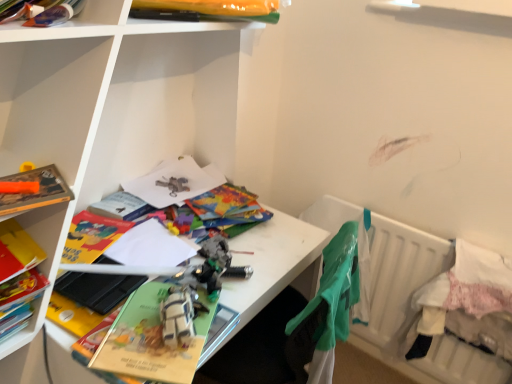
In order to face white plastic table at center, should I rotate leftwards or rightwards?

It's best to rotate right around 0.555 degrees.

What do you see at coordinates (180, 316) in the screenshot? This screenshot has height=384, width=512. I see `white plastic toy at center` at bounding box center [180, 316].

What are the coordinates of `white plastic toy at center` in the screenshot? It's located at (180, 316).

This screenshot has height=384, width=512. What do you see at coordinates (76, 24) in the screenshot? I see `matte plastic books at upper left, which is the 2th shelf in bottom-to-top order` at bounding box center [76, 24].

Describe the element at coordinates (151, 339) in the screenshot. I see `matte green paperback book at center, the first paperback book positioned from the bottom` at that location.

The width and height of the screenshot is (512, 384). Describe the element at coordinates (125, 109) in the screenshot. I see `white matte desk at center, marked as the second shelf in a top-to-bottom arrangement` at that location.

What do you see at coordinates (467, 302) in the screenshot? The width and height of the screenshot is (512, 384). I see `white fabric bed at lower right, which appears as the 1th bed when viewed from the front` at bounding box center [467, 302].

Where is `green fabric at right`? Image resolution: width=512 pixels, height=384 pixels. green fabric at right is located at coordinates (331, 304).

From a real-world perspective, is matte orange book at left, which is the 1th paperback book from left to right, located higher than white matte desk at center, the first shelf viewed from the right?

Correct, in the physical world, matte orange book at left, which is the 1th paperback book from left to right, is higher than white matte desk at center, the first shelf viewed from the right.

Based on the photo, from the image's perspective, who appears lower, matte orange book at left, which is the 1th paperback book from left to right, or white matte desk at center, which is the 2th shelf in left-to-right order?

white matte desk at center, which is the 2th shelf in left-to-right order, from the image's perspective.

Is matte orange book at left, which is the 1th paperback book from left to right, thinner than white matte desk at center, acting as the first shelf starting from the front?

Indeed, matte orange book at left, which is the 1th paperback book from left to right, has a lesser width compared to white matte desk at center, acting as the first shelf starting from the front.

You are a GUI agent. You are given a task and a screenshot of the screen. Output one action in this format:
    pyautogui.click(x=<x>, y=<y>)
    Task: Click on the 1st bed below the white matte desk at center, acting as the first shelf starting from the front (from the image's perspective)
    
    Given the screenshot: What is the action you would take?
    pyautogui.click(x=407, y=304)

Would you say white plastic bed at lower right, which is the 1th bed in back-to-front order, is part of white matte desk at center, which is the second shelf in back-to-front order,'s contents?

No.

How many degrees apart are the facing directions of white matte desk at center, marked as the second shelf in a top-to-bottom arrangement, and white plastic bed at lower right, which is the 1th bed in back-to-front order?

There is a 90.5-degree angle between the facing directions of white matte desk at center, marked as the second shelf in a top-to-bottom arrangement, and white plastic bed at lower right, which is the 1th bed in back-to-front order.

Which object is positioned more to the left, white matte desk at center, which is the 2th shelf in left-to-right order, or white plastic bed at lower right, which is the 1th bed in back-to-front order?

white matte desk at center, which is the 2th shelf in left-to-right order.

Is there a large distance between white matte desk at center, which is the 2th shelf in left-to-right order, and matte green paperback book at center, the second paperback book from the left?

white matte desk at center, which is the 2th shelf in left-to-right order, is actually quite close to matte green paperback book at center, the second paperback book from the left.

Relative to matte green paperback book at center, which is the 1th paperback book from right to left, is white matte desk at center, arranged as the first shelf when ordered from the bottom, in front or behind?

white matte desk at center, arranged as the first shelf when ordered from the bottom, is in front of matte green paperback book at center, which is the 1th paperback book from right to left.

Is matte green paperback book at center, which is the 1th paperback book from right to left, at the back of white matte desk at center, which is the second shelf in back-to-front order?

Yes, white matte desk at center, which is the second shelf in back-to-front order,'s orientation is away from matte green paperback book at center, which is the 1th paperback book from right to left.

From a real-world perspective, is white matte desk at center, which is the second shelf in back-to-front order, over matte green paperback book at center, the first paperback book positioned from the bottom?

Yes.

Is white plastic toy at center positioned beyond the bounds of green fabric at right?

That's correct, white plastic toy at center is outside of green fabric at right.

Looking at this image, considering the positions of objects white plastic toy at center and green fabric at right in the image provided, who is in front, white plastic toy at center or green fabric at right?

green fabric at right is in front.

From a real-world perspective, relative to green fabric at right, is white plastic toy at center vertically above or below?

From a real-world perspective, white plastic toy at center is physically above green fabric at right.

You are a GUI agent. You are given a task and a screenshot of the screen. Output one action in this format:
    pyautogui.click(x=<x>, y=<y>)
    Task: Click on the laundry to the right of white plastic toy at center
    The width and height of the screenshot is (512, 384).
    Given the screenshot: What is the action you would take?
    331,304

Is hardcover book at left, marked as the second book in a top-to-bottom arrangement, next to matte plastic books at upper left, arranged as the second shelf when viewed from the right?

hardcover book at left, marked as the second book in a top-to-bottom arrangement, and matte plastic books at upper left, arranged as the second shelf when viewed from the right, are not in contact.

How far apart are hardcover book at left, arranged as the second book when viewed from the right, and matte plastic books at upper left, which is the first shelf from left to right?

They are 18.36 inches apart.

Find the location of `the 2nd shelf positioned above the hardcover book at left, arranged as the second book when viewed from the right (from the image's perspective)`. the 2nd shelf positioned above the hardcover book at left, arranged as the second book when viewed from the right (from the image's perspective) is located at coordinates (76, 24).

Does hardcover book at left, which ranks as the 1th book in bottom-to-top order, have a greater width compared to matte plastic books at upper left, acting as the second shelf starting from the front?

Correct, the width of hardcover book at left, which ranks as the 1th book in bottom-to-top order, exceeds that of matte plastic books at upper left, acting as the second shelf starting from the front.

Could matte plastic books at upper left, acting as the second shelf starting from the front, be considered to be inside white plastic toy at center?

No, white plastic toy at center does not contain matte plastic books at upper left, acting as the second shelf starting from the front.

Does white plastic toy at center come in front of matte plastic books at upper left, the first shelf viewed from the top?

No, it is not.

Based on the photo, which of these two, white plastic toy at center or matte plastic books at upper left, acting as the second shelf starting from the front, stands shorter?

matte plastic books at upper left, acting as the second shelf starting from the front.

From the image's perspective, which one is positioned lower, white plastic toy at center or matte plastic books at upper left, the first shelf viewed from the top?

white plastic toy at center, from the image's perspective.

The image size is (512, 384). Identify the location of the 1st paperback book directly above the white fabric bed at lower right, which appears as the 1th bed when viewed from the front (from a real-world perspective). (151, 339).

From the picture: From a real-world perspective, which object stands above the other?

matte green paperback book at center, the second paperback book from the left.

Considering the positions of points (120, 343) and (463, 334), is point (120, 343) closer to camera compared to point (463, 334)?

Yes, it is in front of point (463, 334).

Consider the image. Would you say matte green paperback book at center, placed as the 2th paperback book when sorted from top to bottom, contains white fabric bed at lower right, the 2th bed positioned from the back?

That's incorrect, white fabric bed at lower right, the 2th bed positioned from the back, is not inside matte green paperback book at center, placed as the 2th paperback book when sorted from top to bottom.

Image resolution: width=512 pixels, height=384 pixels. I want to click on shelf lying below the matte orange book at left, which is the 1th paperback book from left to right (from the image's perspective), so click(125, 109).

I want to click on the 1st shelf to the left when counting from the white plastic bed at lower right, which is the 1th bed in back-to-front order, so click(125, 109).

Which object lies further to the anchor point matte orange book at left, which is counted as the 1th paperback book, starting from the top, white fabric bed at lower right, which appears as the 1th bed when viewed from the front, or yellow plastic bag at upper center, marked as the 1th book in a top-to-bottom arrangement?

white fabric bed at lower right, which appears as the 1th bed when viewed from the front, lies further to matte orange book at left, which is counted as the 1th paperback book, starting from the top, than the other object.

Which object lies nearer to the anchor point matte plastic books at upper left, the first shelf viewed from the top, green fabric at right or white fabric bed at lower right, the 2th bed positioned from the back?

green fabric at right is positioned closer to the anchor matte plastic books at upper left, the first shelf viewed from the top.

Based on their spatial positions, is matte plastic books at upper left, arranged as the second shelf when viewed from the right, or white matte desk at center, arranged as the first shelf when ordered from the bottom, further from matte orange book at left, which is counted as the 2th paperback book, starting from the right?

white matte desk at center, arranged as the first shelf when ordered from the bottom, is further to matte orange book at left, which is counted as the 2th paperback book, starting from the right.

Which object lies nearer to the anchor point white matte desk at center, which is the 2th shelf in left-to-right order, matte plastic books at upper left, which is the first shelf from left to right, or yellow plastic bag at upper center, positioned as the 1th book in right-to-left order?

Among the two, yellow plastic bag at upper center, positioned as the 1th book in right-to-left order, is located nearer to white matte desk at center, which is the 2th shelf in left-to-right order.

Which object lies further to the anchor point white matte desk at center, arranged as the first shelf when ordered from the bottom, white plastic bed at lower right, positioned as the second bed in front-to-back order, or yellow plastic bag at upper center, marked as the 1th book in a top-to-bottom arrangement?

white plastic bed at lower right, positioned as the second bed in front-to-back order.

Looking at the image, which one is located further to matte orange book at left, which is the 1th paperback book from left to right, white plastic table at center or matte plastic books at upper left, positioned as the 1th shelf in back-to-front order?

Based on the image, white plastic table at center appears to be further to matte orange book at left, which is the 1th paperback book from left to right.

From the image, which object appears to be nearer to matte green paperback book at center, the second paperback book from the left, matte orange book at left, which is counted as the 2th paperback book, starting from the right, or white plastic table at center?

Based on the image, white plastic table at center appears to be nearer to matte green paperback book at center, the second paperback book from the left.

Looking at the image, which one is located further to matte plastic books at upper left, acting as the second shelf starting from the front, white fabric bed at lower right, which appears as the 1th bed when viewed from the front, or hardcover book at left, arranged as the first book when viewed from the left?

white fabric bed at lower right, which appears as the 1th bed when viewed from the front, is further to matte plastic books at upper left, acting as the second shelf starting from the front.

Where is `bed between yellow plastic bag at upper center, which ranks as the 2th book in left-to-right order, and white fabric bed at lower right, the 2th bed positioned from the back, in the vertical direction`? This screenshot has height=384, width=512. bed between yellow plastic bag at upper center, which ranks as the 2th book in left-to-right order, and white fabric bed at lower right, the 2th bed positioned from the back, in the vertical direction is located at coordinates (407, 304).

Find the location of a particular element. This screenshot has width=512, height=384. table between hardcover book at left, which ranks as the 1th book in bottom-to-top order, and white fabric bed at lower right, which appears as the 1th bed when viewed from the front, from left to right is located at coordinates (273, 263).

Image resolution: width=512 pixels, height=384 pixels. I want to click on toy located between matte orange book at left, the 2th paperback book when ordered from bottom to top, and white plastic table at center in the left-right direction, so click(x=180, y=316).

The height and width of the screenshot is (384, 512). I want to click on toy situated between hardcover book at left, marked as the second book in a top-to-bottom arrangement, and green fabric at right from left to right, so click(180, 316).